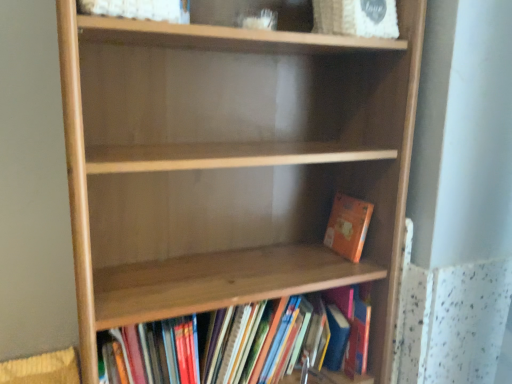
Question: Is natural wood shelf at center looking in the opposite direction of wooden bookshelf at lower center, which is the first book in bottom-to-top order?

Choices:
 (A) no
 (B) yes

Answer: (B)

Question: Is natural wood shelf at center not close to wooden bookshelf at lower center, acting as the 2th book starting from the top?

Choices:
 (A) no
 (B) yes

Answer: (A)

Question: Is natural wood shelf at center not inside wooden bookshelf at lower center, which is the first book in bottom-to-top order?

Choices:
 (A) no
 (B) yes

Answer: (B)

Question: From a real-world perspective, is natural wood shelf at center on top of wooden bookshelf at lower center, acting as the 2th book starting from the top?

Choices:
 (A) yes
 (B) no

Answer: (A)

Question: Does natural wood shelf at center appear on the left side of wooden bookshelf at lower center, acting as the 2th book starting from the top?

Choices:
 (A) no
 (B) yes

Answer: (B)

Question: Does natural wood shelf at center appear on the right side of wooden bookshelf at lower center, acting as the 2th book starting from the top?

Choices:
 (A) no
 (B) yes

Answer: (A)

Question: Considering the relative sizes of wooden bookshelf at lower center, acting as the 2th book starting from the top, and natural wood shelf at center in the image provided, is wooden bookshelf at lower center, acting as the 2th book starting from the top, taller than natural wood shelf at center?

Choices:
 (A) yes
 (B) no

Answer: (B)

Question: From the image's perspective, is wooden bookshelf at lower center, acting as the 2th book starting from the top, below natural wood shelf at center?

Choices:
 (A) yes
 (B) no

Answer: (A)

Question: From a real-world perspective, is wooden bookshelf at lower center, which is the first book in bottom-to-top order, physically below natural wood shelf at center?

Choices:
 (A) no
 (B) yes

Answer: (B)

Question: Could you tell me if wooden bookshelf at lower center, acting as the 2th book starting from the top, is facing natural wood shelf at center?

Choices:
 (A) no
 (B) yes

Answer: (B)

Question: From the image's perspective, is wooden bookshelf at lower center, which is the first book in bottom-to-top order, above natural wood shelf at center?

Choices:
 (A) yes
 (B) no

Answer: (B)

Question: Can you confirm if wooden bookshelf at lower center, which is the first book in bottom-to-top order, is smaller than natural wood shelf at center?

Choices:
 (A) yes
 (B) no

Answer: (A)

Question: Is orange matte book at lower right, positioned as the second book in bottom-to-top order, behind wooden bookshelf at lower center, acting as the 2th book starting from the top?

Choices:
 (A) no
 (B) yes

Answer: (B)